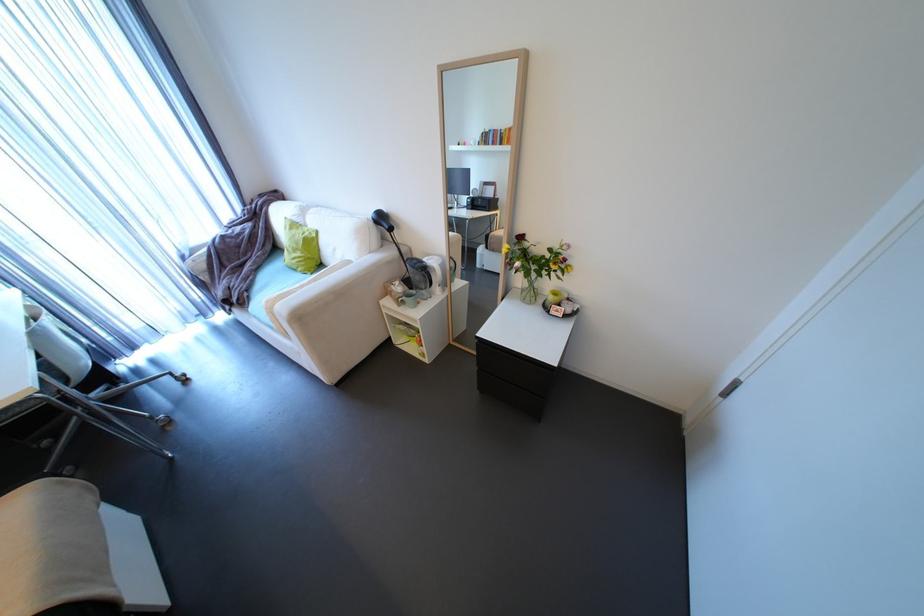
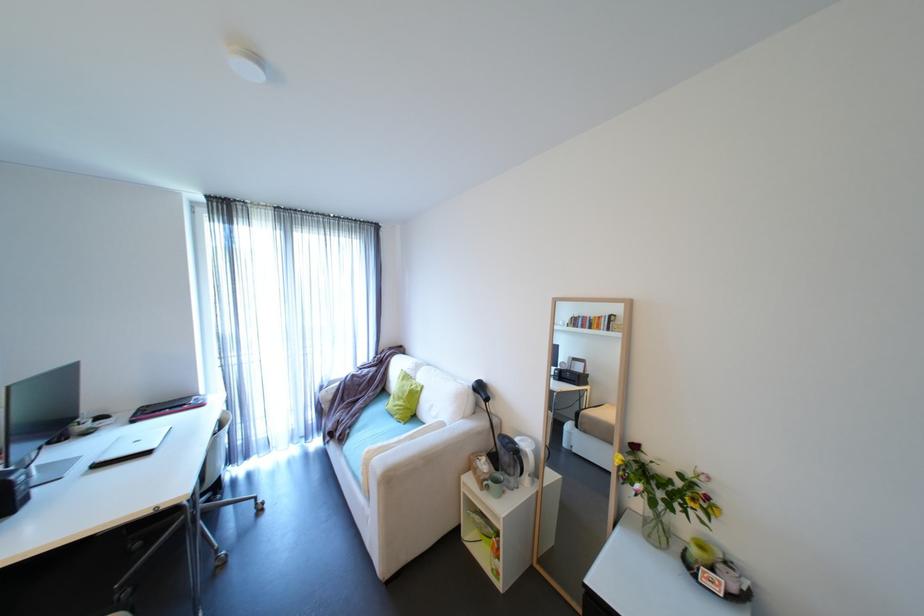
Locate, in the second image, the point that corresponds to pixel 310 253 in the first image.

(411, 402)